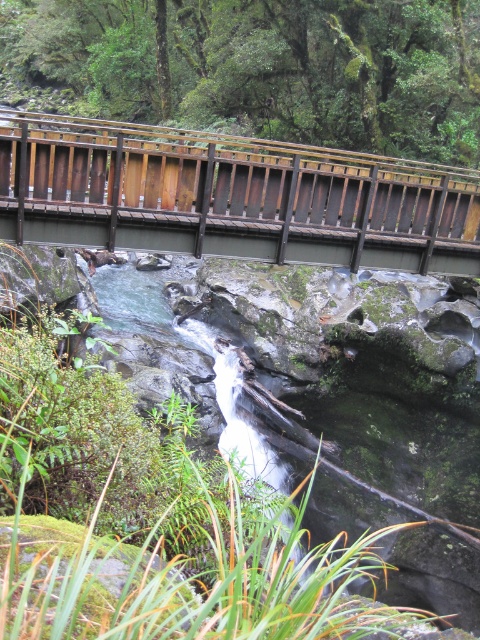
You are standing at the origin point of the image coordinate system where the bottom left corner is the origin. You want to locate the green mossy rocks at upper center. What are their coordinates?

The coordinates of the green mossy rocks at upper center are at point (257,68).

You are standing on the wooden bridge and looking down at the rocky stream below. There are two points marked on the rocks below you. Which point is closer to you, point (219,0) or point (385,236)?

Point (219,0) is closer to you because it is further to the viewer than point (385,236).

You are a hiker trying to cross the brown wooden bridge at upper center. You notice green mossy rocks at upper center nearby. Are the rocks above or below the bridge?

The green mossy rocks at upper center are located above the brown wooden bridge at upper center.